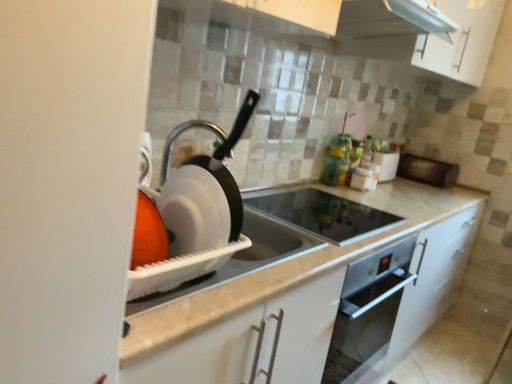
At what (x,y) coordinates should I click in order to perform the action: click on vacant area that is in front of black matte microwave at right, placed as the 4th appliance when sorted from left to right. Please return your answer as a coordinate pair (x, y). Looking at the image, I should click on 436,187.